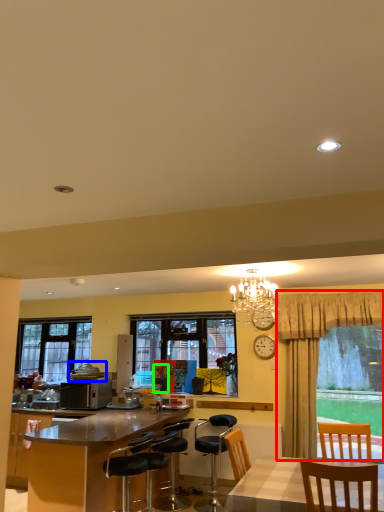
Question: Which object is positioned farthest from curtain (highlighted by a red box)? Select from tableware (highlighted by a blue box) and person (highlighted by a green box).

Choices:
 (A) tableware
 (B) person

Answer: (A)